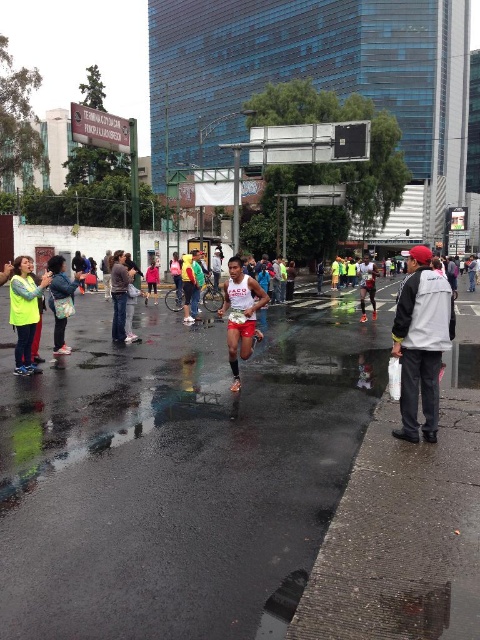
You are a spectator at the marathon and want to find the neon yellow vest at left and the pink fabric jacket at center in the crowd. Which one would you notice first from a distance?

The pink fabric jacket at center is larger than the neon yellow vest at left, so you would notice the pink fabric jacket at center first from a distance.

You are a runner in the marathon and you want to find the neon yellow vest at left. According to the scene, where should you look?

The neon yellow vest at left is located at point (25, 310) in the scene.

You are a runner in the marathon and you need to reach the neon yellow vest at left as quickly as possible. What should you do?

The neon yellow vest at left is 8.59 meters away from you, so you should sprint towards it to cover the distance quickly.